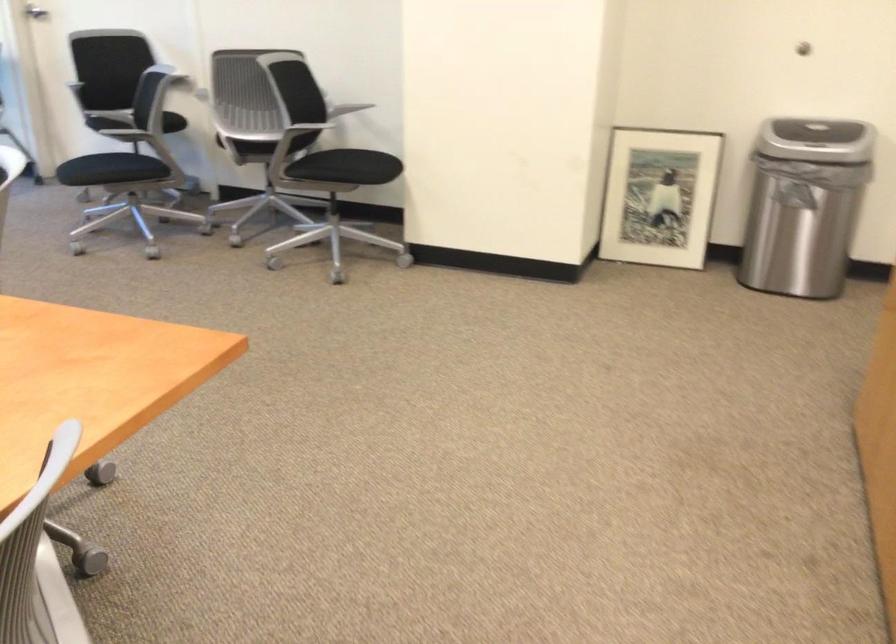
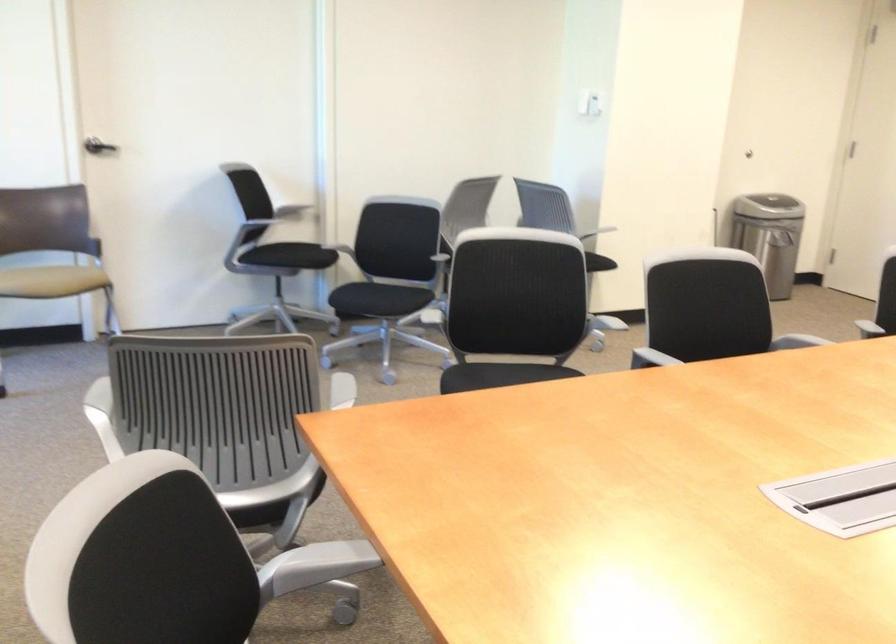
Find the pixel in the second image that matches (121,155) in the first image.

(377, 299)